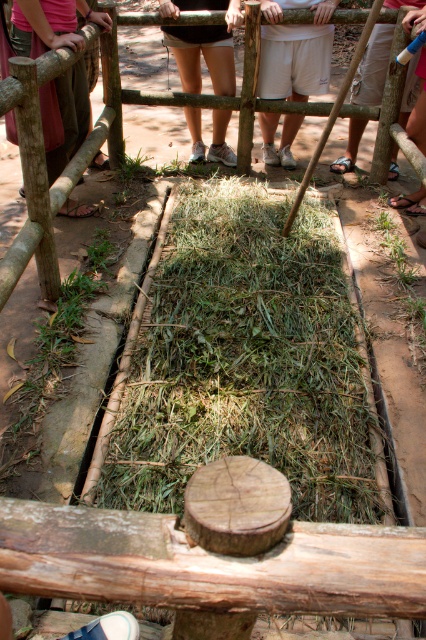
Does green grassy hay at center come in front of white cotton shorts at center?

Yes.

Who is lower down, green grassy hay at center or white cotton shorts at center?

green grassy hay at center

Who is more distant from viewer, (138, 339) or (271, 132)?

Positioned behind is point (271, 132).

Identify the location of green grassy hay at center. (245, 362).

Who is more distant from viewer, (245, 108) or (63, 212)?

Point (245, 108)

Which is in front, point (342, 13) or point (74, 29)?

Point (74, 29) is in front.

The width and height of the screenshot is (426, 640). Identify the location of brown wooden fence at center. (19, 257).

Can you confirm if green grassy hay at center is smaller than brown wooden fence at center?

Correct, green grassy hay at center occupies less space than brown wooden fence at center.

Does point (316, 408) come closer to viewer compared to point (328, 106)?

Yes, it is in front of point (328, 106).

The image size is (426, 640). I want to click on green grassy hay at center, so click(x=245, y=362).